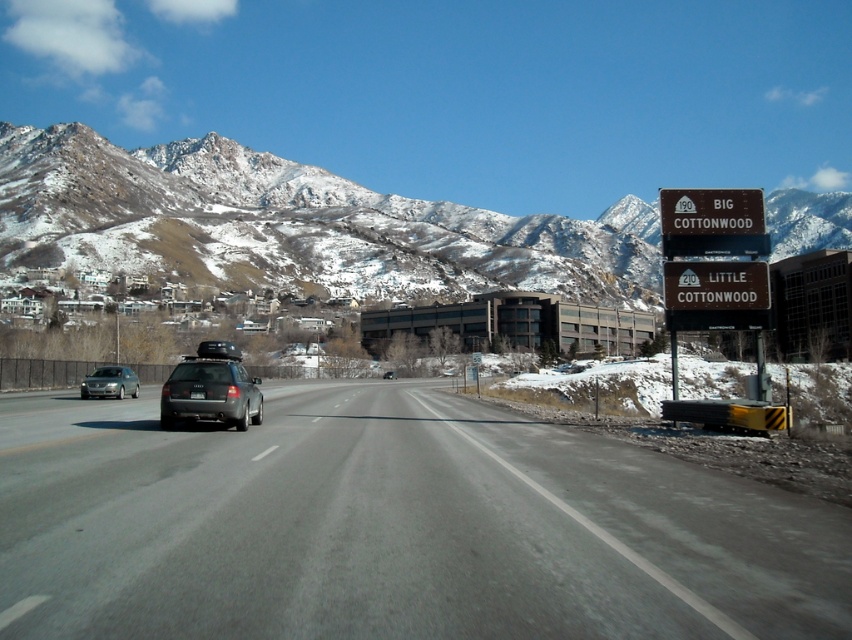
Question: Among these objects, which one is nearest to the camera?

Choices:
 (A) satin silver suv at center-left
 (B) brown/wooden sign at upper right
 (C) gray asphalt road at center

Answer: (C)

Question: Can you confirm if gray asphalt road at center is bigger than matte black suv at center?

Choices:
 (A) no
 (B) yes

Answer: (A)

Question: Considering the relative positions of brown/wooden sign at upper right and satin silver suv at center-left in the image provided, where is brown/wooden sign at upper right located with respect to satin silver suv at center-left?

Choices:
 (A) left
 (B) right

Answer: (B)

Question: Which point is closer to the camera taking this photo?

Choices:
 (A) (360, 620)
 (B) (119, 372)

Answer: (A)

Question: Which is nearer to the brown/wooden sign at upper right?

Choices:
 (A) satin silver suv at center-left
 (B) snowy rocky mountain at upper left

Answer: (A)

Question: Is brown/wooden sign at upper right to the left of matte black suv at center from the viewer's perspective?

Choices:
 (A) yes
 (B) no

Answer: (B)